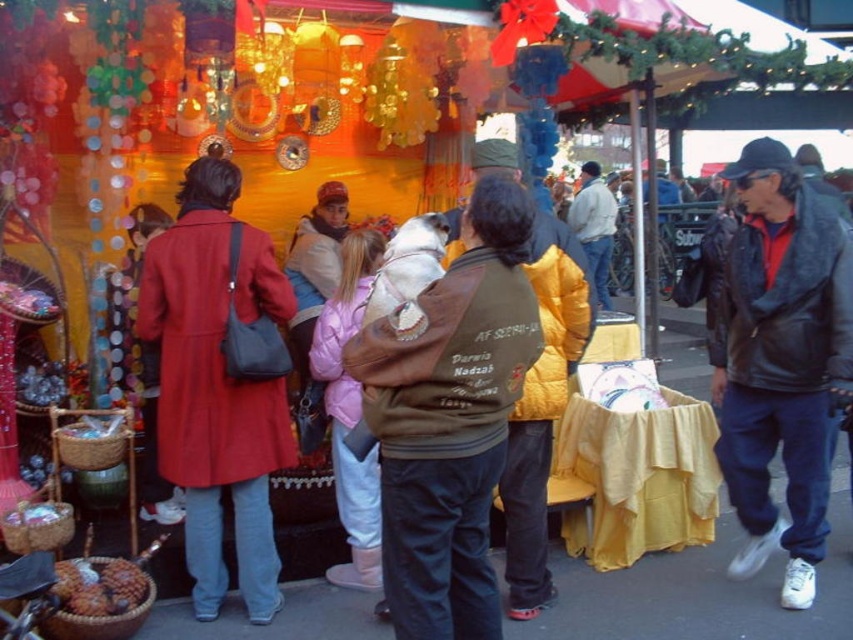
Looking at this image, based on the coordinates provided, which object is located at point [450,417] in the image?

The point [450,417] marks the location of the brown leather jacket at center.

Consider the image. You are a photographer at the market and want to capture both the brown leather jacket at center and the matte red coat at left in a single frame. Which person should you position closer to the camera to ensure both are fully visible?

Since the brown leather jacket at center is smaller in size compared to the matte red coat at left, you should position the person in the brown leather jacket at center closer to the camera to balance their sizes in the photo.